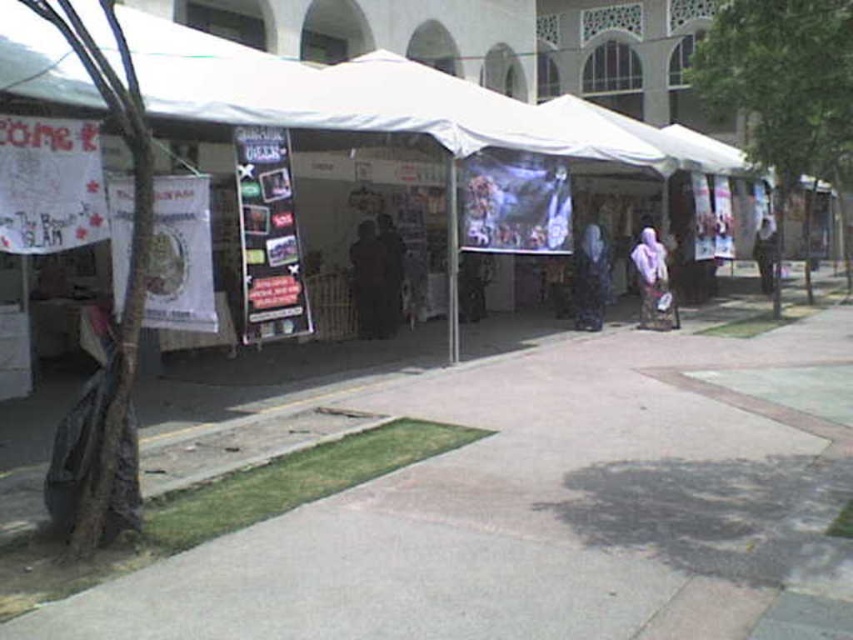
Question: In this image, where is purple fabric at center located relative to matte black dress at center?

Choices:
 (A) right
 (B) left

Answer: (A)

Question: Can you confirm if purple fabric at center is positioned above matte black dress at center?

Choices:
 (A) yes
 (B) no

Answer: (B)

Question: Which of the following is the farthest from the observer?

Choices:
 (A) (596, 276)
 (B) (426, 124)
 (C) (637, 268)

Answer: (C)

Question: Where is concrete at center located in relation to dark brown leather jacket at center in the image?

Choices:
 (A) left
 (B) right

Answer: (B)

Question: Which object appears farthest from the camera in this image?

Choices:
 (A) purple fabric at center
 (B) matte black dress at center

Answer: (A)

Question: Considering the real-world distances, which object is farthest from the white fabric canopy at upper center?

Choices:
 (A) dark brown leather jacket at center
 (B) dark brown wooden door at center
 (C) matte black dress at center

Answer: (C)